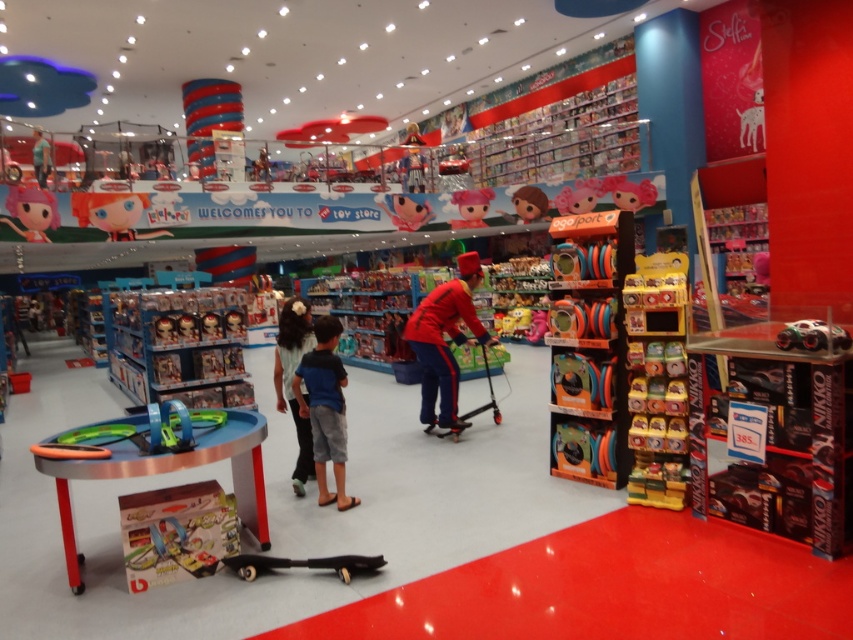
Does point (305, 346) come farther from viewer compared to point (387, 204)?

No.

At what (x,y) coordinates should I click in order to perform the action: click on light blue denim jeans at center. Please return your answer as a coordinate pair (x, y). Looking at the image, I should click on (292, 378).

Is orange matte sport disc at center right thinner than shiny plastic doll at upper left?

Yes.

Which is in front, point (567, 449) or point (38, 193)?

Point (567, 449) is more forward.

Does point (598, 268) lie in front of point (38, 236)?

Yes.

At what (x,y) coordinates should I click in order to perform the action: click on orange matte sport disc at center right. Please return your answer as a coordinate pair (x, y). Looking at the image, I should click on (589, 346).

Consider the image. Which of these two, shiny plastic doll at upper left or matte black doll at upper left, stands taller?

matte black doll at upper left

Does point (35, 195) come in front of point (50, 168)?

Yes, point (35, 195) is in front of point (50, 168).

The height and width of the screenshot is (640, 853). Identify the location of shiny plastic doll at upper left. (32, 212).